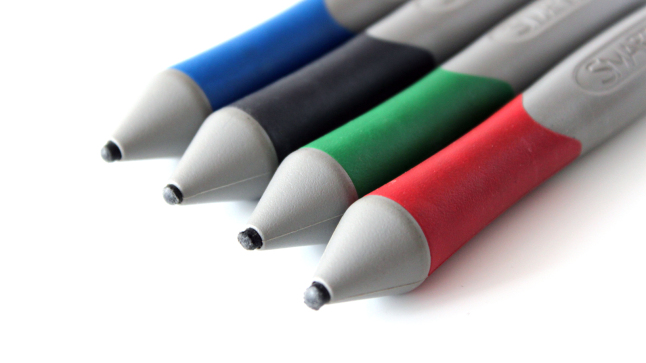
Locate an element on the screen. Image resolution: width=646 pixels, height=363 pixels. markers is located at coordinates (256, 40), (342, 87), (391, 109), (491, 142).